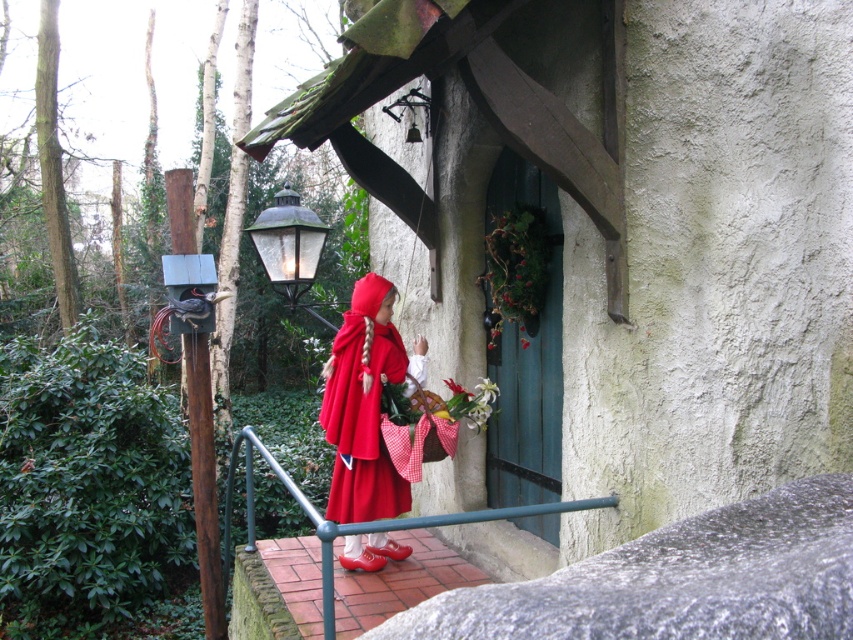
You are standing at the starting point of the brick pathway leading to the stone building. There are two points marked on the path. The first point is at coordinates point (370, 346) and the second point is at coordinates point (468, 422). If you walk towards the building, which point will you reach first?

Point (370, 346) is in front of point (468, 422), so you will reach point (370, 346) first as it is closer to your starting position.

You are a photographer trying to capture the child in the scene. Since you want to focus on the child, you need to ensure the matte red cape at center and the white matte flower at center are not overlapping. Based on their sizes, which object should you position closer to the camera to prevent overlap?

The matte red cape at center is larger in size than the white matte flower at center. To prevent overlap, position the larger matte red cape at center closer to the camera so it covers less of the flower behind it.